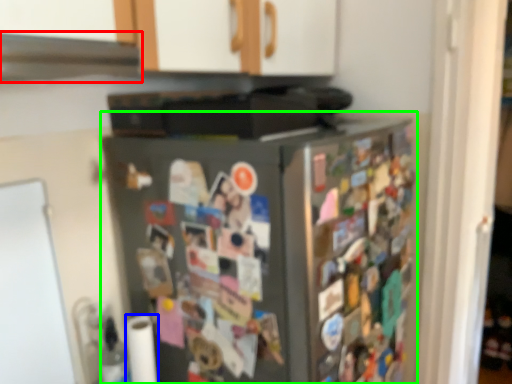
Question: Based on their relative distances, which object is nearer to exhaust hood (highlighted by a red box)? Choose from toilet paper (highlighted by a blue box) and refrigerator (highlighted by a green box).

Choices:
 (A) toilet paper
 (B) refrigerator

Answer: (B)